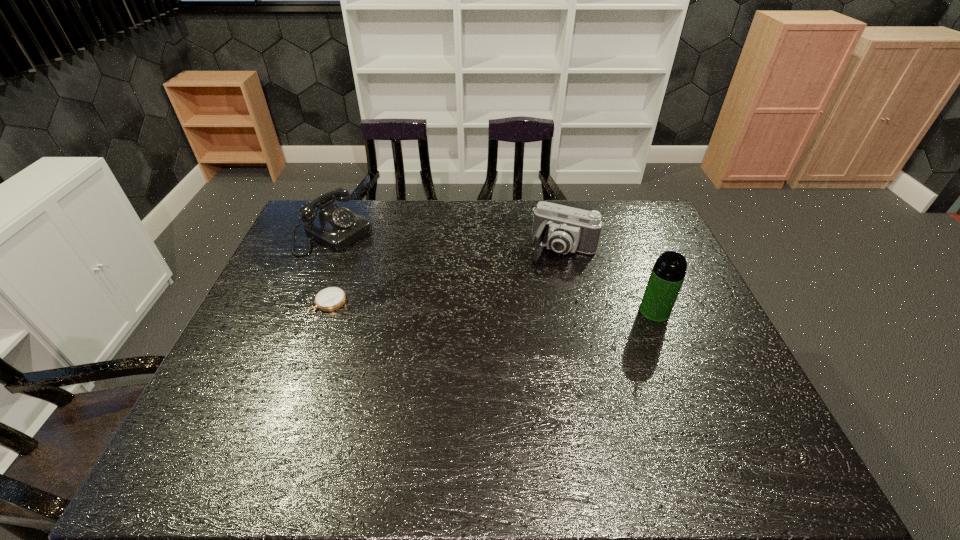
Identify the location of empty space between the telephone and the third object from left to right. The height and width of the screenshot is (540, 960). (449, 242).

This screenshot has height=540, width=960. What are the coordinates of `vacant space that is in between the telephone and the second object from right to left` in the screenshot? It's located at (449, 242).

This screenshot has width=960, height=540. Identify the location of unoccupied position between the telephone and the shortest object. (332, 268).

Where is `empty location between the telephone and the compass`? empty location between the telephone and the compass is located at coordinates (332, 268).

You are a GUI agent. You are given a task and a screenshot of the screen. Output one action in this format:
    pyautogui.click(x=<x>, y=<y>)
    Task: Click on the vacant point located between the thermos bottle and the camera
    This screenshot has height=540, width=960.
    Given the screenshot: What is the action you would take?
    pyautogui.click(x=609, y=280)

Locate an element on the screen. Image resolution: width=960 pixels, height=540 pixels. object that is the nearest to the third object from left to right is located at coordinates (668, 273).

Choose which object is the nearest neighbor to the second object from right to left. Please provide its 2D coordinates. Your answer should be formatted as a tuple, i.e. [(x, y)], where the tuple contains the x and y coordinates of a point satisfying the conditions above.

[(668, 273)]

This screenshot has height=540, width=960. I want to click on vacant area in the image that satisfies the following two spatial constraints: 1. on the front side of the telephone; 2. on the right side of the compass, so click(x=307, y=303).